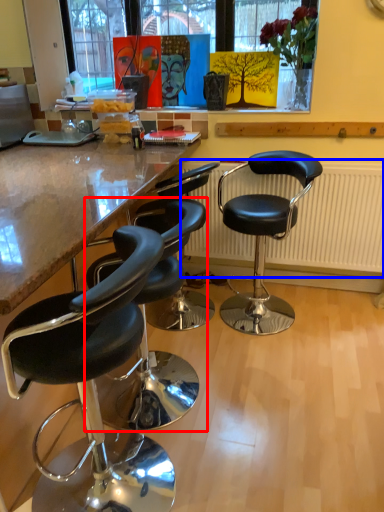
Question: Which object appears farthest to the camera in this image, chair (highlighted by a red box) or radiator (highlighted by a blue box)?

Choices:
 (A) chair
 (B) radiator

Answer: (B)